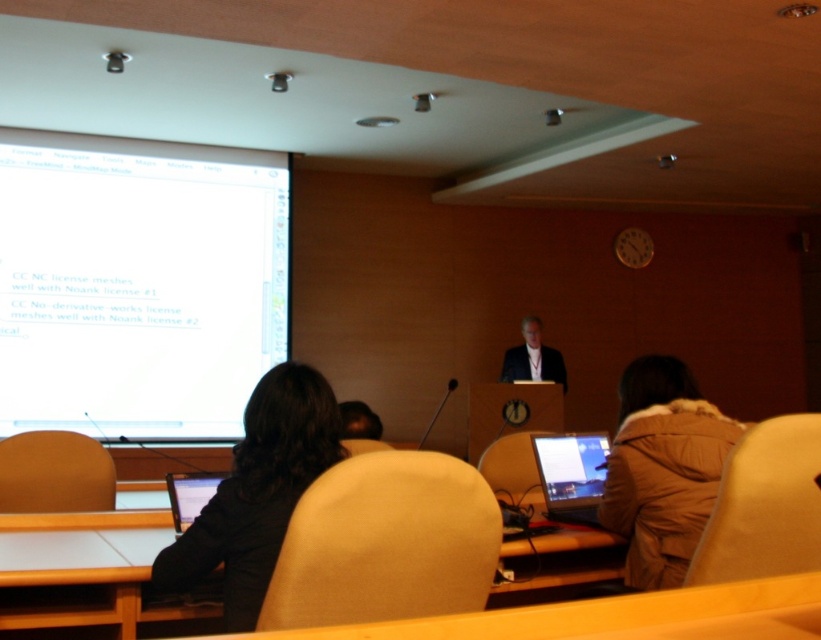
Question: Which of the following is the closest to the observer?

Choices:
 (A) (668, 545)
 (B) (388, 445)

Answer: (A)

Question: Which point is closer to the camera?

Choices:
 (A) white glossy projection screen at upper left
 (B) smooth beige chair at center

Answer: (B)

Question: Among these points, which one is nearest to the camera?

Choices:
 (A) (597, 497)
 (B) (521, 324)

Answer: (A)

Question: Is matte black laptop at lower center above dark brown hair at center?

Choices:
 (A) yes
 (B) no

Answer: (B)

Question: Is white glossy projection screen at upper left to the left of matte brown chair at lower left from the viewer's perspective?

Choices:
 (A) yes
 (B) no

Answer: (A)

Question: Observing the image, what is the correct spatial positioning of matte black laptop at lower left in reference to dark brown hair at center?

Choices:
 (A) below
 (B) above

Answer: (A)